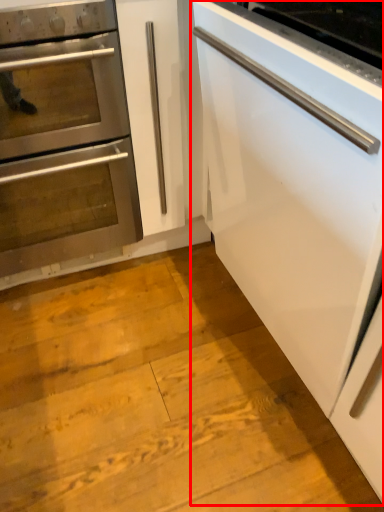
Question: From the image's perspective, what is the correct spatial relationship of cabinetry (annotated by the red box) in relation to oven?

Choices:
 (A) above
 (B) below

Answer: (B)